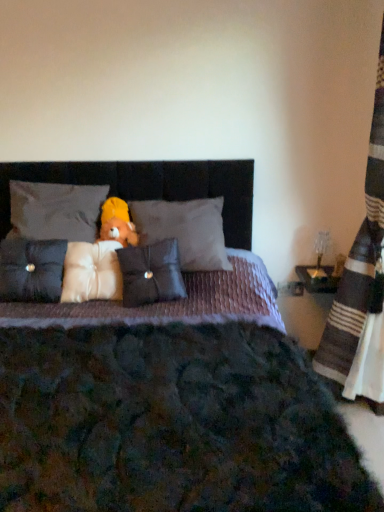
Question: Can we say suede-like gray pillow at left, arranged as the 5th pillow when viewed from the right, lies outside translucent glass table lamp at right?

Choices:
 (A) no
 (B) yes

Answer: (B)

Question: Does suede-like gray pillow at left, which is counted as the first pillow, starting from the left, have a lesser height compared to translucent glass table lamp at right?

Choices:
 (A) yes
 (B) no

Answer: (B)

Question: Can you confirm if suede-like gray pillow at left, which is counted as the first pillow, starting from the left, is bigger than translucent glass table lamp at right?

Choices:
 (A) yes
 (B) no

Answer: (A)

Question: From a real-world perspective, is suede-like gray pillow at left, which is counted as the first pillow, starting from the left, physically below translucent glass table lamp at right?

Choices:
 (A) yes
 (B) no

Answer: (B)

Question: Does suede-like gray pillow at left, arranged as the 5th pillow when viewed from the right, lie behind translucent glass table lamp at right?

Choices:
 (A) no
 (B) yes

Answer: (A)

Question: From a real-world perspective, is velvet purple bed at center physically located above or below yellow plush bear at center?

Choices:
 (A) above
 (B) below

Answer: (B)

Question: Do you think velvet purple bed at center is within yellow plush bear at center, or outside of it?

Choices:
 (A) inside
 (B) outside

Answer: (B)

Question: Is velvet purple bed at center bigger or smaller than yellow plush bear at center?

Choices:
 (A) small
 (B) big

Answer: (B)

Question: From the image's perspective, is velvet purple bed at center above or below yellow plush bear at center?

Choices:
 (A) above
 (B) below

Answer: (B)

Question: In terms of height, does white soft pillow at center, marked as the third pillow in a right-to-left arrangement, look taller or shorter compared to white satin pillow at upper center, arranged as the fourth pillow when viewed from the right?

Choices:
 (A) tall
 (B) short

Answer: (A)

Question: In the image, is white soft pillow at center, the third pillow in the left-to-right sequence, positioned in front of or behind white satin pillow at upper center, positioned as the second pillow in left-to-right order?

Choices:
 (A) front
 (B) behind

Answer: (A)

Question: From a real-world perspective, is white soft pillow at center, marked as the third pillow in a right-to-left arrangement, above or below white satin pillow at upper center, positioned as the second pillow in left-to-right order?

Choices:
 (A) above
 (B) below

Answer: (B)

Question: Based on their sizes in the image, would you say white soft pillow at center, the third pillow in the left-to-right sequence, is bigger or smaller than white satin pillow at upper center, positioned as the second pillow in left-to-right order?

Choices:
 (A) small
 (B) big

Answer: (A)

Question: Is velvet gray pillow at center, arranged as the 1th pillow when viewed from the right, in front of or behind white soft pillow at center, the third pillow in the left-to-right sequence, in the image?

Choices:
 (A) front
 (B) behind

Answer: (B)

Question: Does point (163, 203) appear closer or farther from the camera than point (64, 280)?

Choices:
 (A) closer
 (B) farther

Answer: (B)